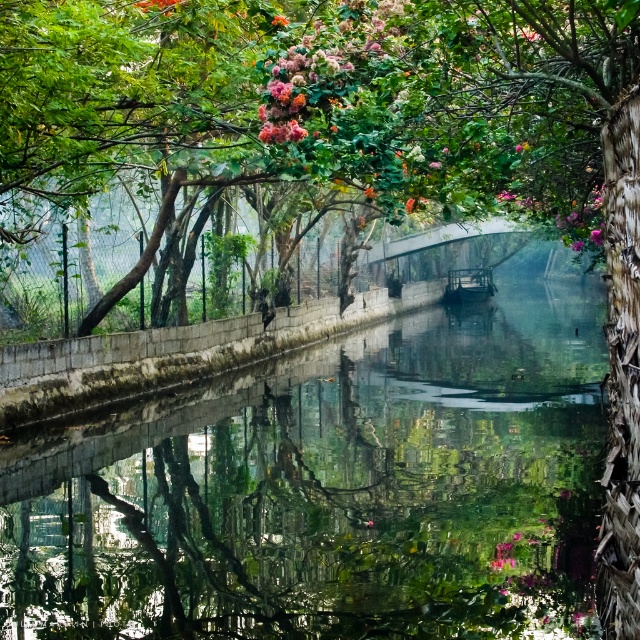
You are a gardener looking at the canal scene. You notice two pink matte flowers in the upper part of the image. Which one is closer to you, the pink matte flower at upper right or the pink matte flower at upper center?

The pink matte flower at upper right is closer to you because the pink matte flower at upper center is behind it.

You are standing at the edge of the canal and notice two points marked in the scene. Which of the two points, point (x=310, y=42) or point (x=157, y=1), is closer to you?

Point (x=310, y=42) is closer to the viewer than point (x=157, y=1).